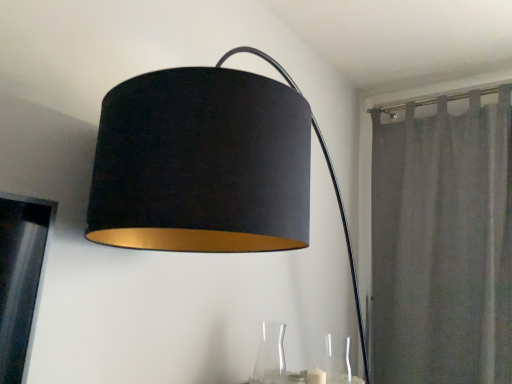
Question: Is white matte candle at lower center taller or shorter than transparent glass vase at lower right, which is the second glass vase in left-to-right order?

Choices:
 (A) tall
 (B) short

Answer: (B)

Question: From the image's perspective, relative to transparent glass vase at lower right, which is the second glass vase in left-to-right order, is white matte candle at lower center above or below?

Choices:
 (A) below
 (B) above

Answer: (A)

Question: Which is nearer to the transparent glass vase at lower center, the first glass vase viewed from the left?

Choices:
 (A) gray fabric curtain at right
 (B) white matte candle at lower center
 (C) transparent glass vase at lower right, arranged as the 1th glass vase when viewed from the right

Answer: (B)

Question: Estimate the real-world distances between objects in this image. Which object is closer to the gray fabric curtain at right?

Choices:
 (A) transparent glass vase at lower center, the first glass vase viewed from the left
 (B) white matte candle at lower center
 (C) transparent glass vase at lower right, arranged as the 1th glass vase when viewed from the right

Answer: (C)